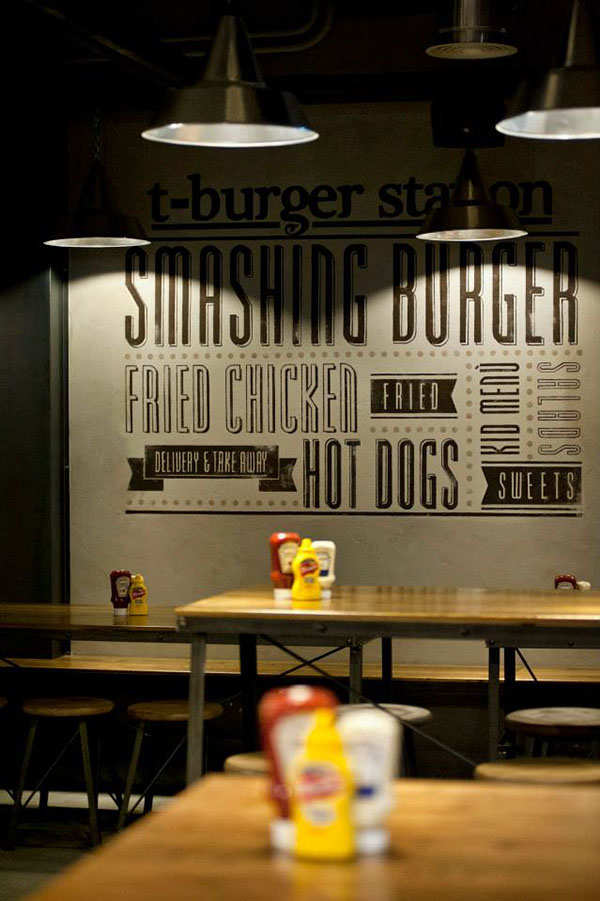
Identify the location of wall. This screenshot has width=600, height=901. pos(87,515).